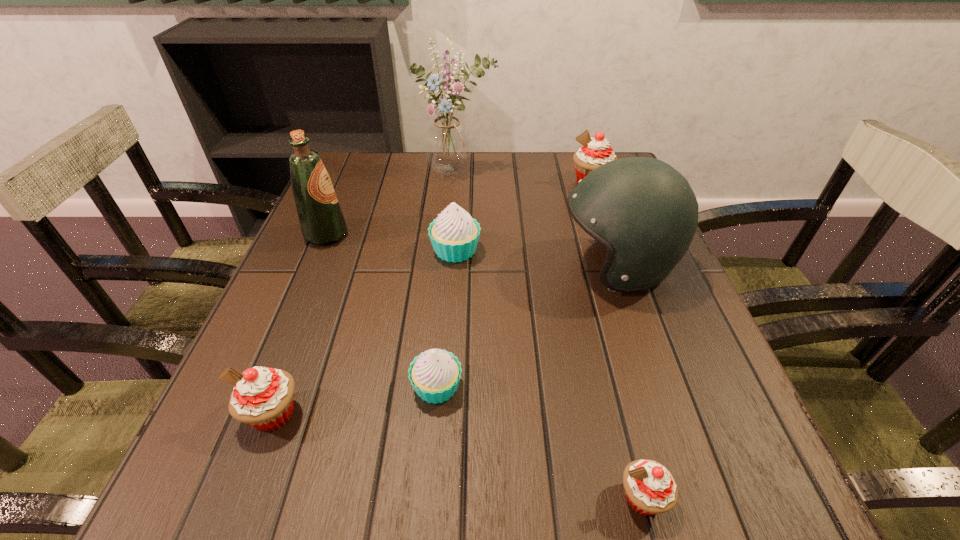
The height and width of the screenshot is (540, 960). In order to click on blank space located 0.180m on the right of the second biggest pink cupcake in this screenshot , I will do `click(421, 414)`.

Locate an element on the screen. vacant space located 0.150m on the right of the smaller white cupcake is located at coordinates (557, 387).

You are a GUI agent. You are given a task and a screenshot of the screen. Output one action in this format:
    pyautogui.click(x=<x>, y=<y>)
    Task: Click on the vacant space located 0.280m on the back of the nearest cupcake
    
    Given the screenshot: What is the action you would take?
    pyautogui.click(x=596, y=319)

This screenshot has width=960, height=540. I want to click on bouquet located at the far edge, so click(447, 142).

I want to click on cupcake that is at the far edge, so click(595, 151).

Where is `object that is positioned at the near edge`? object that is positioned at the near edge is located at coordinates (650, 488).

Where is `olive oil that is at the left edge`? This screenshot has width=960, height=540. olive oil that is at the left edge is located at coordinates (321, 219).

The height and width of the screenshot is (540, 960). In order to click on cupcake that is at the left edge in this screenshot , I will do `click(263, 398)`.

Where is `football helmet that is positioned at the right edge`? This screenshot has height=540, width=960. football helmet that is positioned at the right edge is located at coordinates (645, 213).

Where is `object situated at the far right corner`? The image size is (960, 540). object situated at the far right corner is located at coordinates (595, 151).